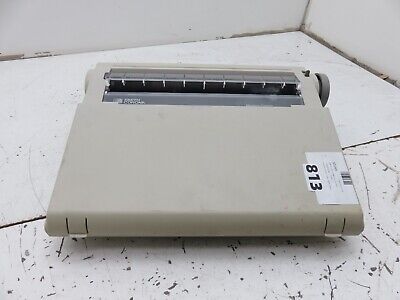
At what (x,y) coordinates should I click in order to perform the action: click on wall. Please return your answer as a coordinate pair (x, y). The width and height of the screenshot is (400, 300). Looking at the image, I should click on (197, 13), (341, 30).